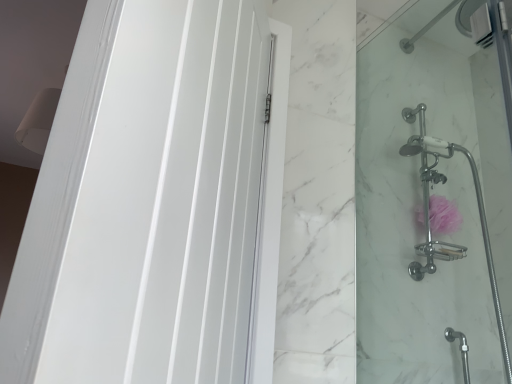
Question: From a real-world perspective, is clear glass shower door at right physically below white glossy door at left?

Choices:
 (A) no
 (B) yes

Answer: (A)

Question: Is clear glass shower door at right thinner than white glossy door at left?

Choices:
 (A) no
 (B) yes

Answer: (B)

Question: Can you confirm if clear glass shower door at right is shorter than white glossy door at left?

Choices:
 (A) yes
 (B) no

Answer: (B)

Question: Considering the relative positions of clear glass shower door at right and white glossy door at left in the image provided, is clear glass shower door at right to the right of white glossy door at left from the viewer's perspective?

Choices:
 (A) yes
 (B) no

Answer: (A)

Question: Does clear glass shower door at right have a smaller size compared to white glossy door at left?

Choices:
 (A) no
 (B) yes

Answer: (A)

Question: Is clear glass shower door at right oriented towards white glossy door at left?

Choices:
 (A) no
 (B) yes

Answer: (B)

Question: Could pink fabric sponge at right be considered to be inside white glossy door at left?

Choices:
 (A) yes
 (B) no

Answer: (B)

Question: Is white glossy door at left facing away from pink fabric sponge at right?

Choices:
 (A) yes
 (B) no

Answer: (B)

Question: Is white glossy door at left wider than pink fabric sponge at right?

Choices:
 (A) yes
 (B) no

Answer: (A)

Question: Can you confirm if white glossy door at left is smaller than pink fabric sponge at right?

Choices:
 (A) yes
 (B) no

Answer: (B)

Question: Is white glossy door at left positioned behind pink fabric sponge at right?

Choices:
 (A) no
 (B) yes

Answer: (A)

Question: Is white glossy door at left touching pink fabric sponge at right?

Choices:
 (A) no
 (B) yes

Answer: (A)

Question: Is white glossy door at left thinner than clear glass shower door at right?

Choices:
 (A) yes
 (B) no

Answer: (B)